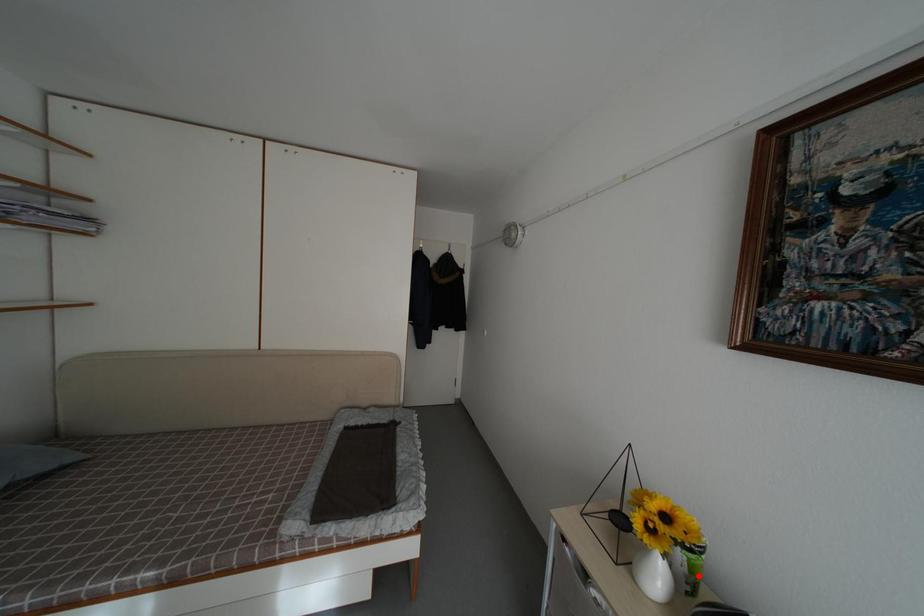
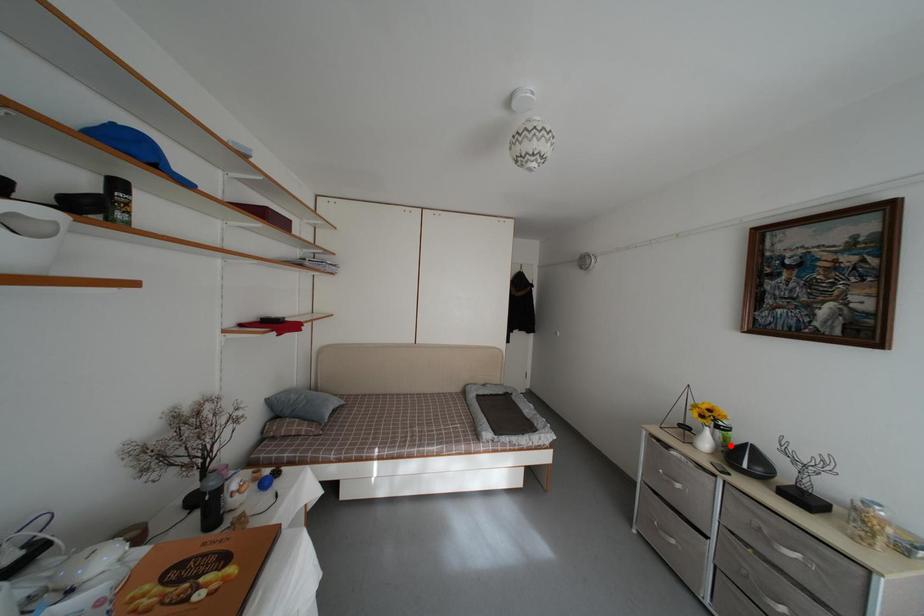
I am providing you with two images of the same scene from different viewpoints. A red point is marked on the first image and another point is marked on the second image. Is the red point in image1 aligned with the point shown in image2?

Yes